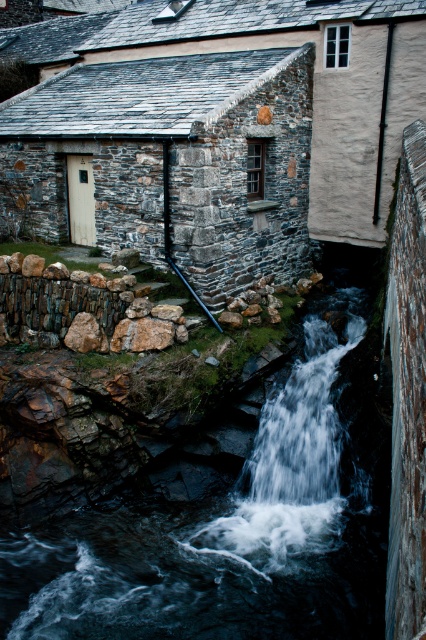
From the picture: You are standing at the edge of a river and want to cross it to reach the rustic stone building. The only path available is a narrow wooden bridge that spans the rocky stone waterfall at center. The bridge is 6 meters long. Do you think the bridge will be long enough to safely cross the waterfall?

The distance between the rocky stone waterfall at center and the camera is 5.96 meters. The bridge is 6 meters long, which is slightly longer than the distance. Therefore, the bridge should be long enough to safely cross the rocky stone waterfall at center.

You are standing at the point marked as point (233, 524) in the image of the rustic stone building and waterfall. What is the nearest object to you?

The nearest object to you at point (233, 524) is the rocky stone waterfall at center.